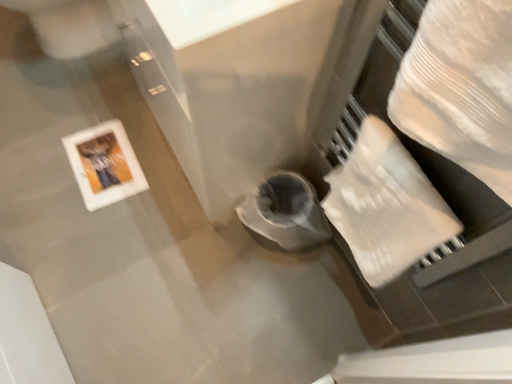
Identify the location of vacant area on top of white glossy picture frame at upper left (from a real-world perspective). The image size is (512, 384). [x=100, y=161].